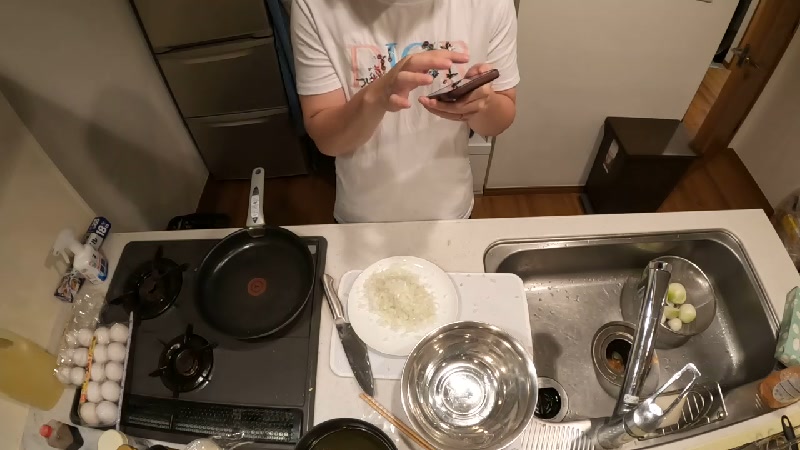
Where is `plate`? The height and width of the screenshot is (450, 800). plate is located at coordinates (406, 303).